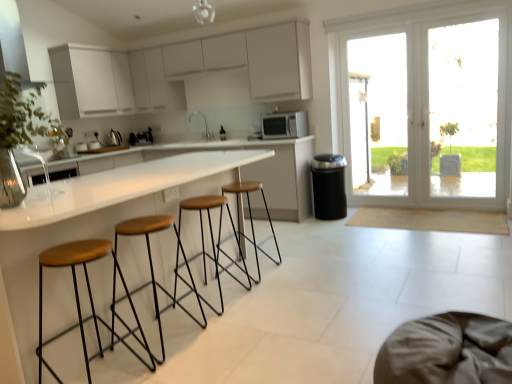
Question: From the image's perspective, is brown fabric swivel chair at lower right positioned above or below brown leather stool at center, acting as the third stool starting from the front?

Choices:
 (A) above
 (B) below

Answer: (B)

Question: Looking at their shapes, would you say brown fabric swivel chair at lower right is wider or thinner than brown leather stool at center, acting as the third stool starting from the front?

Choices:
 (A) wide
 (B) thin

Answer: (A)

Question: Which of these objects is positioned farthest from the brown leather stool at center, acting as the third stool starting from the front?

Choices:
 (A) metallic silver vent at upper left
 (B) brown leather stool at lower left, the first stool when ordered from front to back
 (C) metallic silver kettle at center, the first appliance in the back-to-front sequence
 (D) white matte microwave at center, which ranks as the second appliance in back-to-front order
 (E) transparent glass door at right

Answer: (E)

Question: Estimate the real-world distances between objects in this image. Which object is closer to the white matte microwave at center, placed as the first appliance when sorted from right to left?

Choices:
 (A) transparent glass door at right
 (B) brown fabric swivel chair at lower right
 (C) matte white cabinets at upper left, the 2th cabinetry from the right
 (D) metallic silver kettle at center, arranged as the 2th appliance when viewed from the right
 (E) brown leather stool at center, arranged as the fourth stool when viewed from the front

Answer: (E)